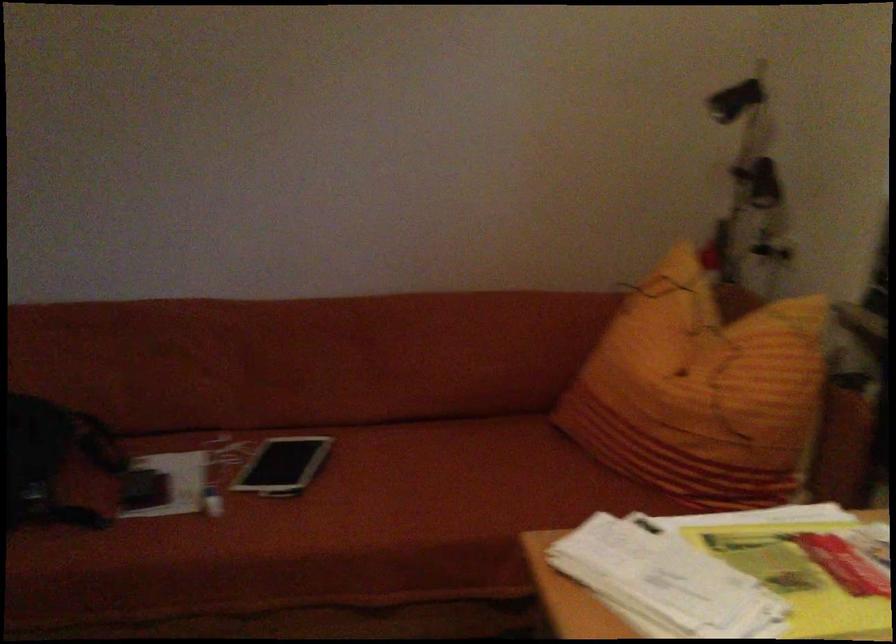
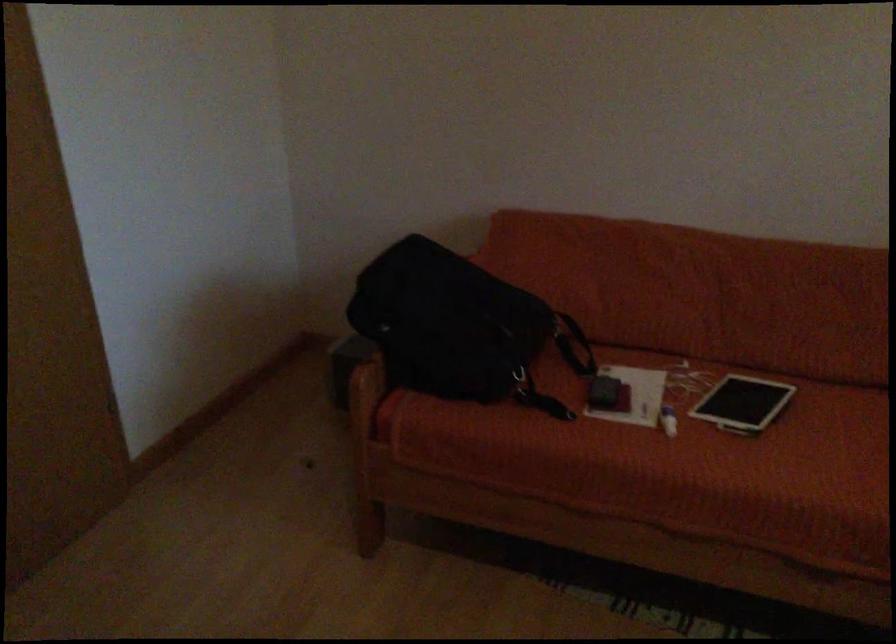
Find the pixel in the second image that matches (359,516) in the first image.

(823, 471)